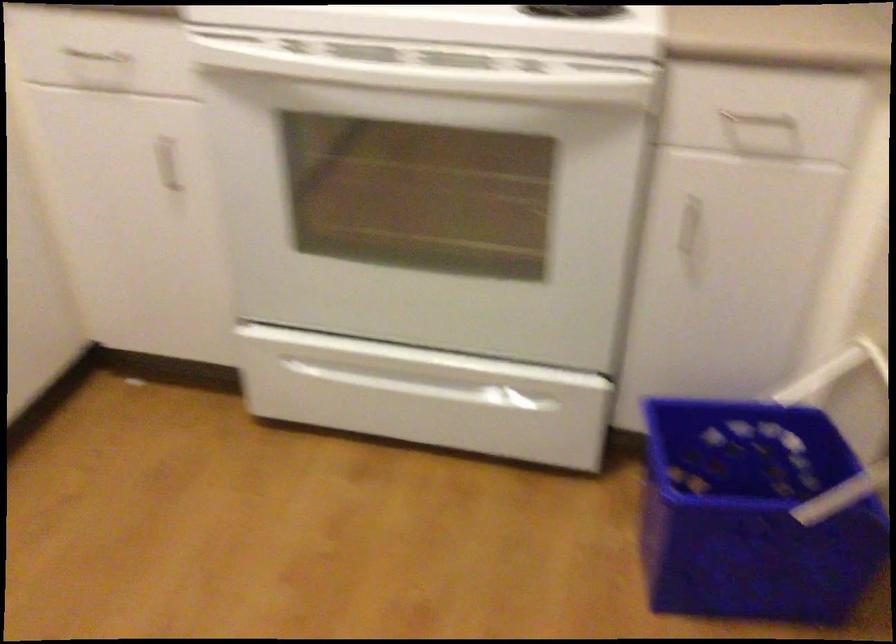
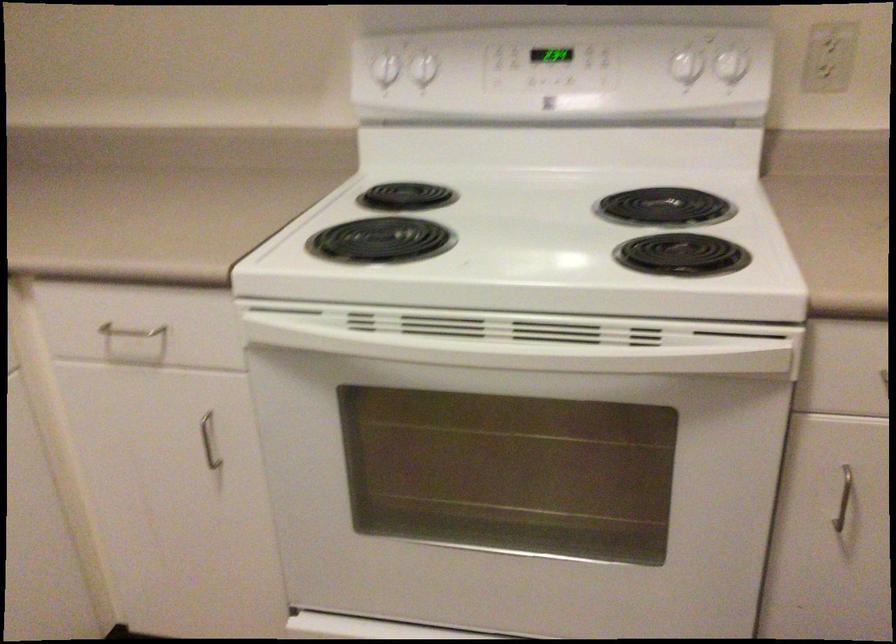
Where in the second image is the point corresponding to point (107, 77) from the first image?

(136, 337)